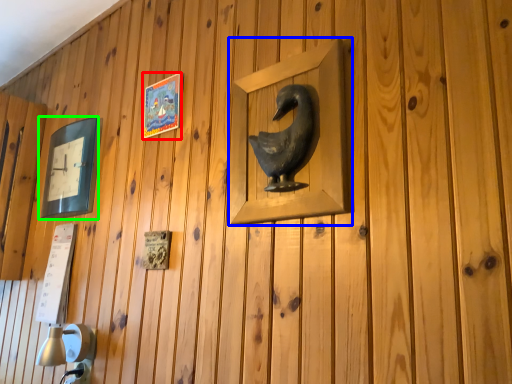
Question: Considering the real-world distances, which object is closest to picture frame (highlighted by a red box)? picture frame (highlighted by a blue box) or picture frame (highlighted by a green box).

Choices:
 (A) picture frame
 (B) picture frame

Answer: (B)